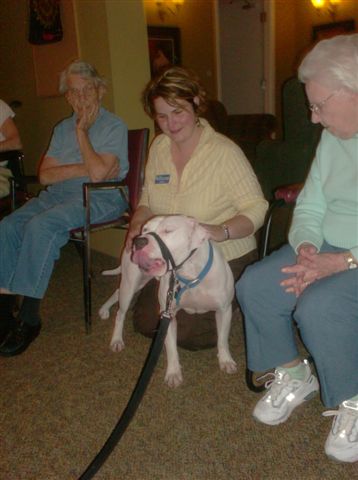
I want to click on yellow wall, so click(x=98, y=42).